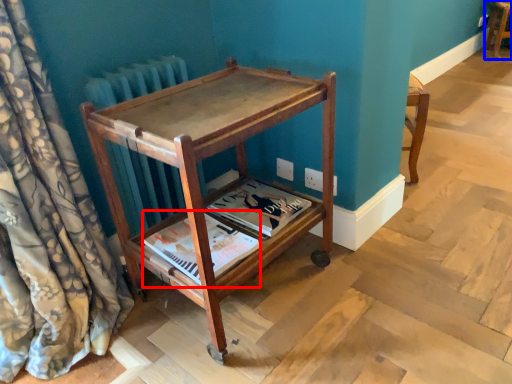
Question: Which of the following is the closest to the observer, magazine (highlighted by a red box) or furniture (highlighted by a blue box)?

Choices:
 (A) magazine
 (B) furniture

Answer: (A)